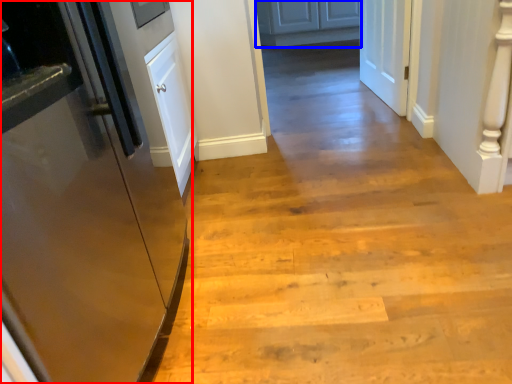
Question: Which object is further to the camera taking this photo, door (highlighted by a red box) or cabinetry (highlighted by a blue box)?

Choices:
 (A) door
 (B) cabinetry

Answer: (B)